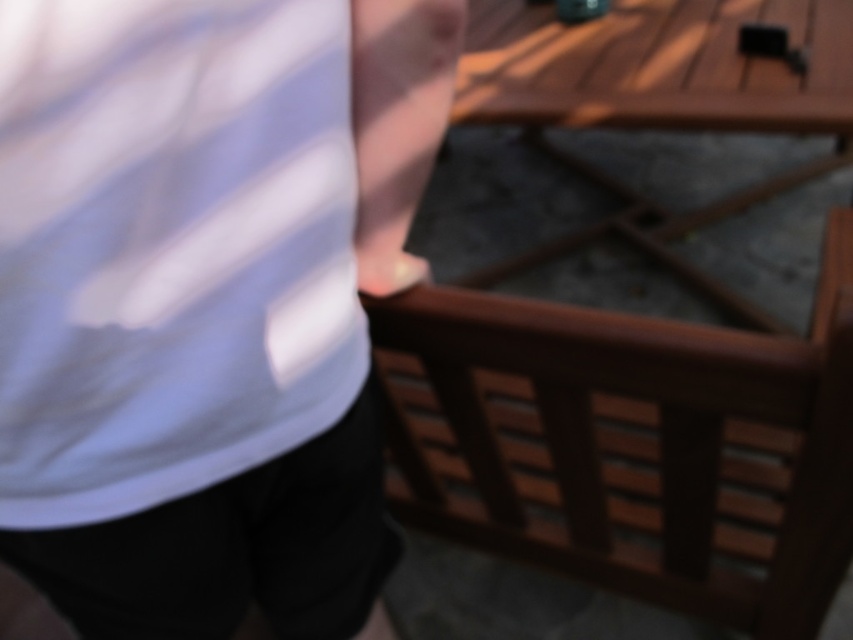
Question: Can you confirm if wooden picnic table at center is wider than black cotton shorts at lower left?

Choices:
 (A) no
 (B) yes

Answer: (B)

Question: Which point is farther to the camera?

Choices:
 (A) (767, 180)
 (B) (285, 518)

Answer: (A)

Question: Which of the following is the farthest from the observer?

Choices:
 (A) wooden picnic table at center
 (B) brown wooden balustrade at right

Answer: (A)

Question: Can you confirm if brown wooden balustrade at right is smaller than black cotton shorts at lower left?

Choices:
 (A) no
 (B) yes

Answer: (A)

Question: Among these points, which one is farthest from the camera?

Choices:
 (A) (357, 560)
 (B) (660, 20)
 (C) (581, 333)

Answer: (B)

Question: Does white matte shirt at upper left appear on the left side of wooden picnic table at center?

Choices:
 (A) no
 (B) yes

Answer: (B)